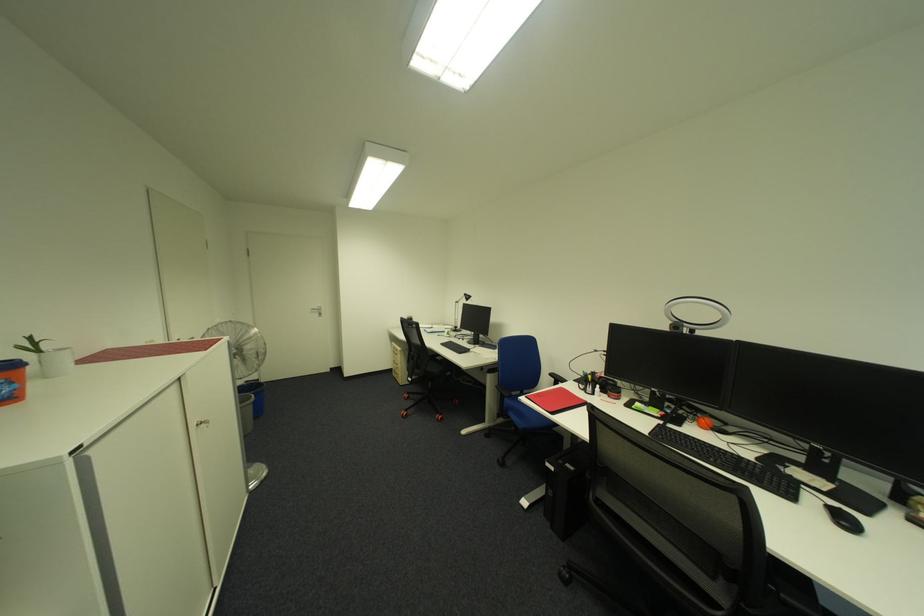
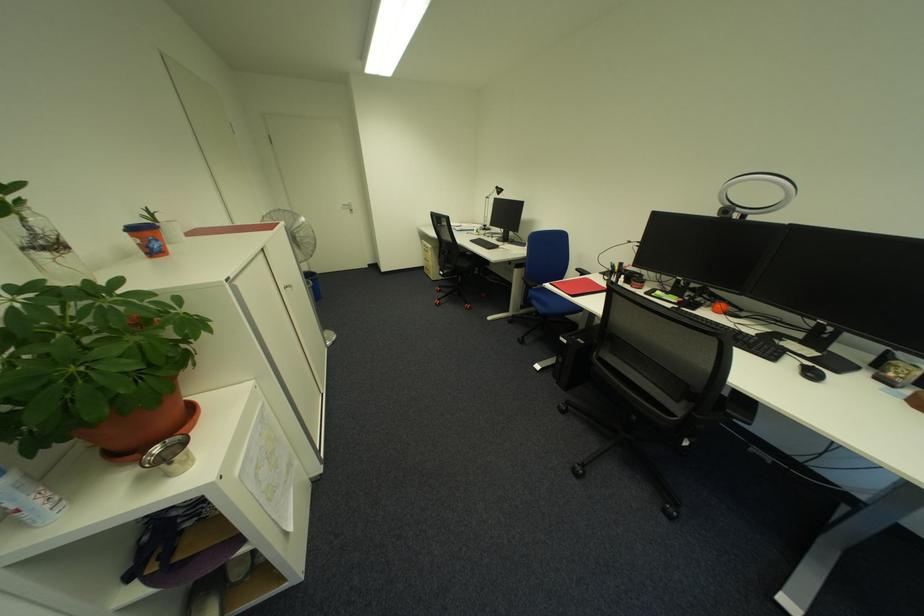
In the second image, find the point that corresponds to point (854, 524) in the first image.

(820, 376)